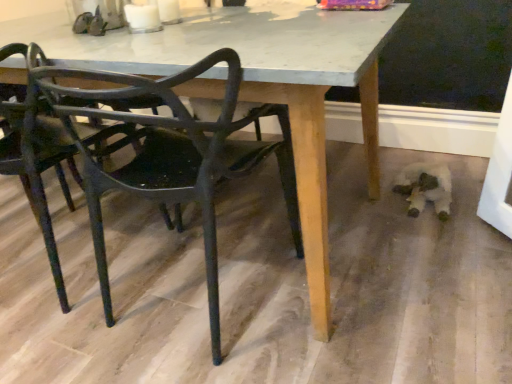
Locate an element on the screen. vacant space to the right of matte black chair at lower left, which is the first chair from right to left is located at coordinates (364, 285).